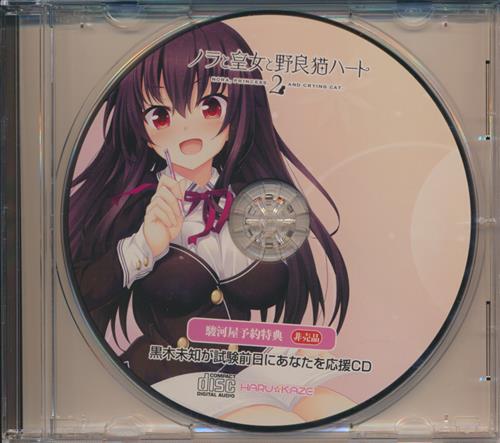
You are a GUI agent. You are given a task and a screenshot of the screen. Output one action in this format:
    pyautogui.click(x=<x>, y=<y>)
    Task: Click on the cd case
    This screenshot has height=443, width=500.
    Given the screenshot: What is the action you would take?
    pyautogui.click(x=468, y=50)